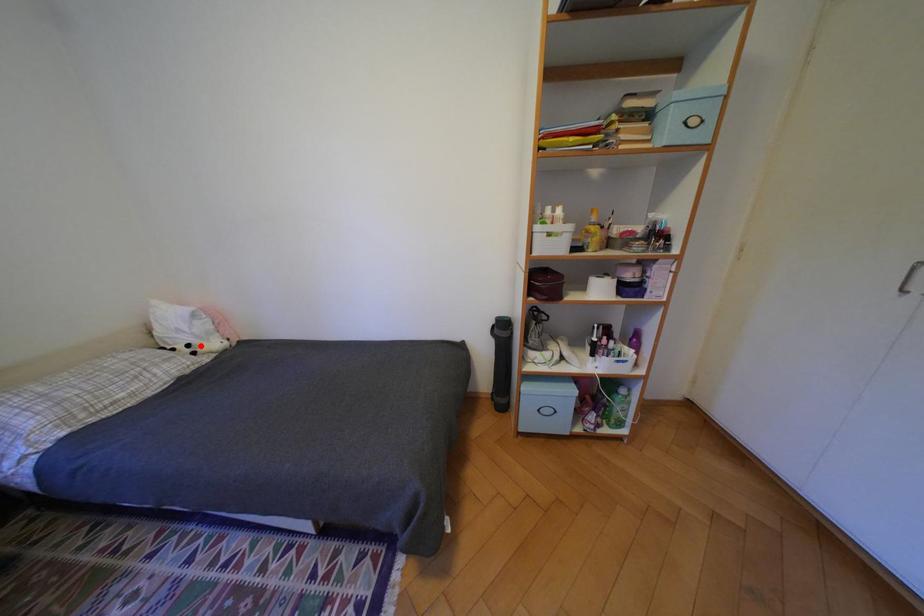
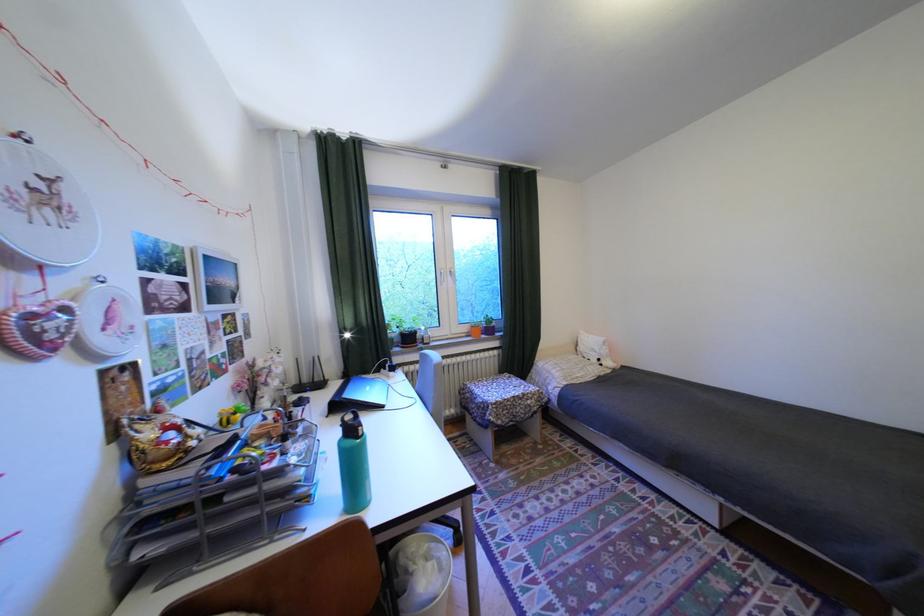
Find the pixel in the second image that matches the highlighted location in the first image.

(611, 360)